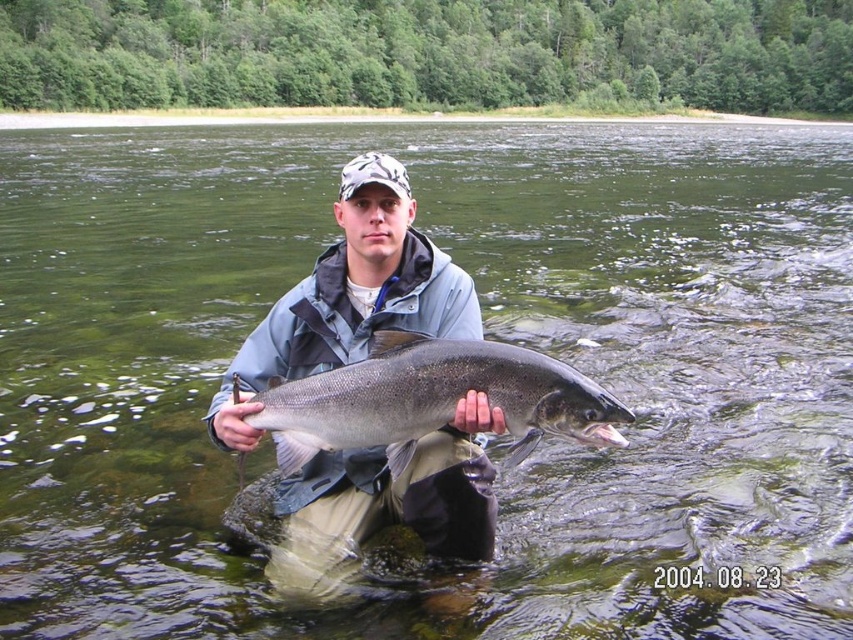
Is gray matte fish at center smaller than shiny silver fish at center?

No.

In the scene shown: Which of these two, gray matte fish at center or shiny silver fish at center, stands shorter?

shiny silver fish at center

This screenshot has width=853, height=640. What do you see at coordinates (350, 296) in the screenshot?
I see `gray matte fish at center` at bounding box center [350, 296].

Locate an element on the screen. The image size is (853, 640). gray matte fish at center is located at coordinates (350, 296).